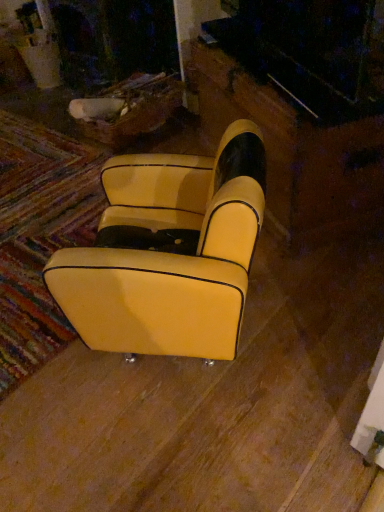
This screenshot has height=512, width=384. What do you see at coordinates (169, 252) in the screenshot?
I see `yellow leather chair at center` at bounding box center [169, 252].

Locate an element on the screen. This screenshot has height=512, width=384. yellow leather chair at center is located at coordinates point(169,252).

This screenshot has width=384, height=512. I want to click on yellow leather chair at center, so click(169, 252).